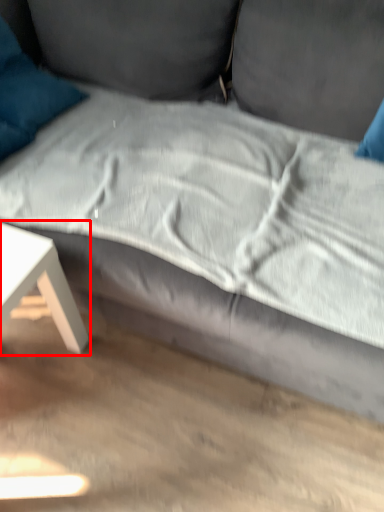
Question: Considering the relative positions of table (annotated by the red box) and pillow in the image provided, where is table (annotated by the red box) located with respect to the staircase?

Choices:
 (A) left
 (B) right

Answer: (A)